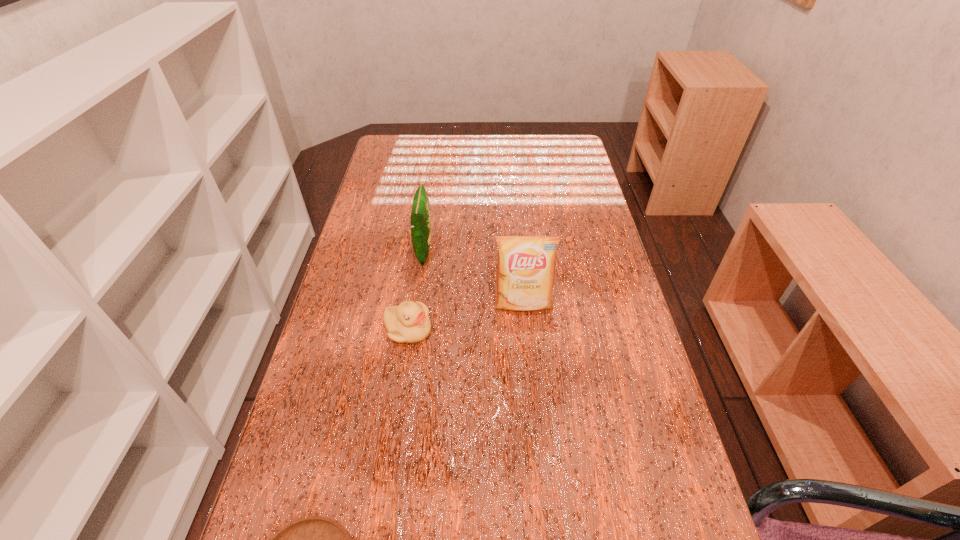
Identify the location of vacant space at the left edge of the desktop. This screenshot has width=960, height=540. (393, 280).

The image size is (960, 540). I want to click on vacant space at the right edge, so click(590, 296).

Identify the location of vacant space in between the duckling and the rightmost object. (466, 317).

Locate an element on the screen. vacant point located between the duckling and the nearer crisp (potato chip) is located at coordinates (466, 317).

Where is `free space between the duckling and the farthest object`? free space between the duckling and the farthest object is located at coordinates (416, 291).

You are a GUI agent. You are given a task and a screenshot of the screen. Output one action in this format:
    pyautogui.click(x=<x>, y=<y>)
    Task: Click on the free spot between the rightmost object and the duckling
    
    Given the screenshot: What is the action you would take?
    466,317

Find the location of a particular element. object that ranks as the closest to the duckling is located at coordinates (525, 275).

Select which object appears as the third closest to the right crisp (potato chip). Please provide its 2D coordinates. Your answer should be formatted as a tuple, i.e. [(x, y)], where the tuple contains the x and y coordinates of a point satisfying the conditions above.

[(315, 539)]

At what (x,y) coordinates should I click in order to perform the action: click on free space that satisfies the following two spatial constraints: 1. on the front-facing side of the rightmost object; 2. on the beak of the duckling. Please return your answer as a coordinate pair (x, y). Looking at the image, I should click on (525, 330).

Where is `vacant space that satisfies the following two spatial constraints: 1. on the front-facing side of the nearer crisp (potato chip); 2. on the beak of the duckling`? vacant space that satisfies the following two spatial constraints: 1. on the front-facing side of the nearer crisp (potato chip); 2. on the beak of the duckling is located at coordinates (525, 330).